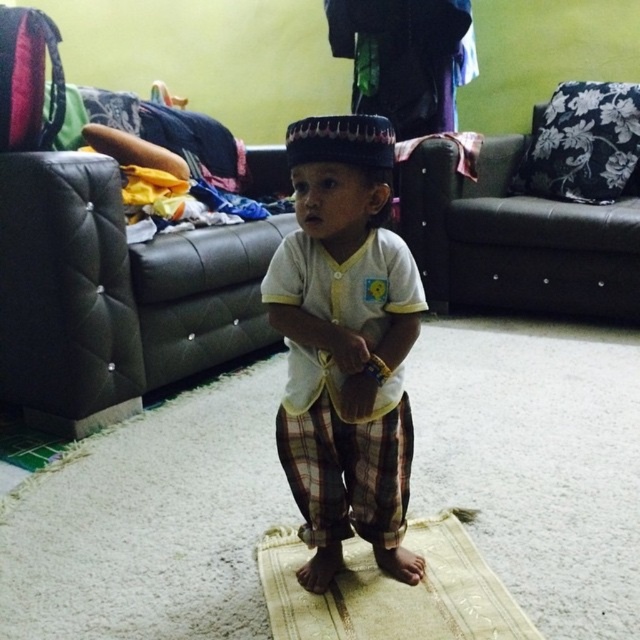
Question: Does white cotton shirt at center appear under beige woven mat at center?

Choices:
 (A) yes
 (B) no

Answer: (B)

Question: Which of the following is the farthest from the observer?

Choices:
 (A) beige woven mat at center
 (B) white cotton shirt at center

Answer: (A)

Question: Considering the relative positions of white cotton shirt at center and beige woven mat at center in the image provided, where is white cotton shirt at center located with respect to beige woven mat at center?

Choices:
 (A) left
 (B) right

Answer: (A)

Question: Does white cotton shirt at center appear under beige woven mat at center?

Choices:
 (A) no
 (B) yes

Answer: (A)

Question: Which object appears closest to the camera in this image?

Choices:
 (A) white cotton shirt at center
 (B) beige woven mat at center

Answer: (A)